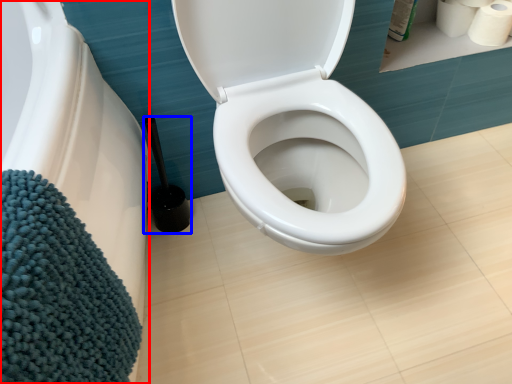
Question: Which of the following is the closest to the observer, bath (highlighted by a red box) or brush (highlighted by a blue box)?

Choices:
 (A) bath
 (B) brush

Answer: (A)